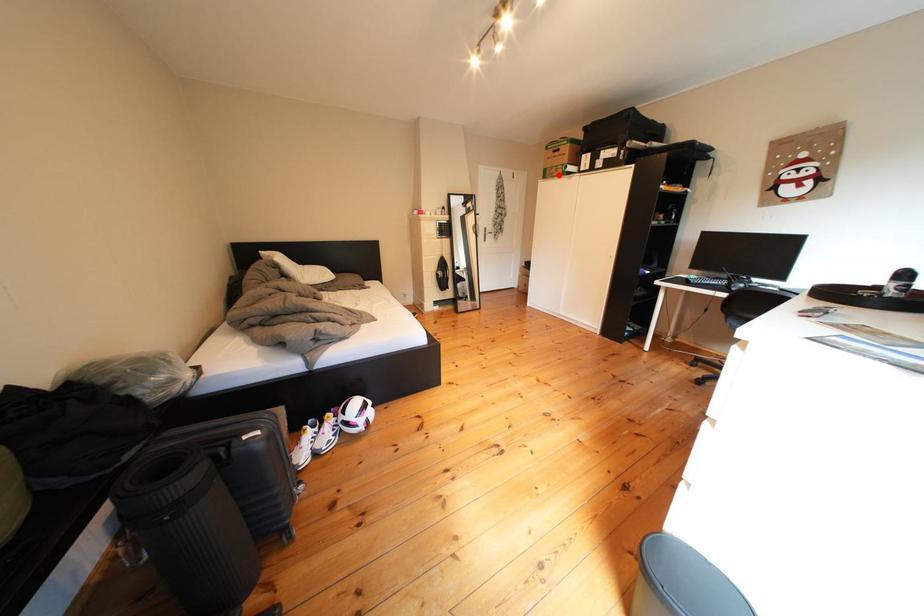
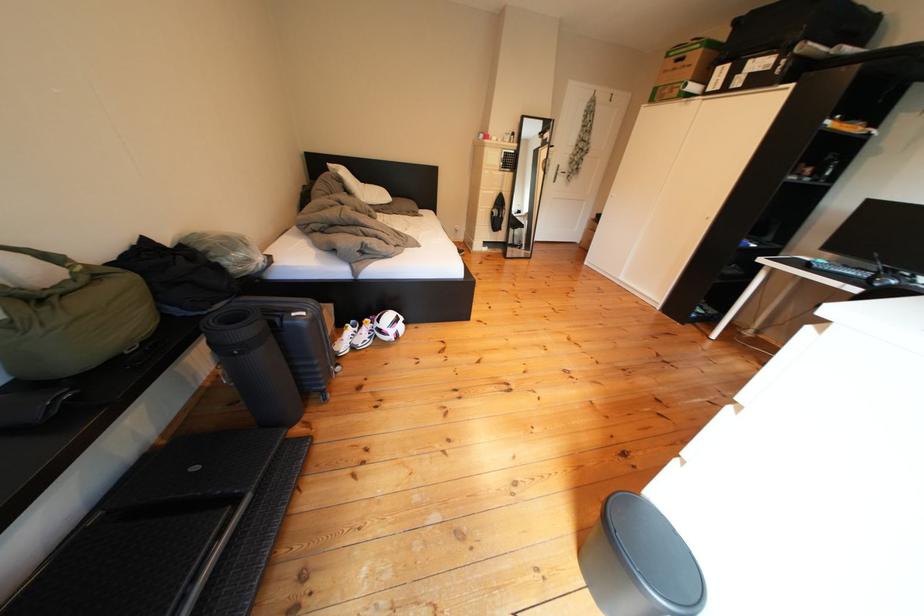
The point at the highlighted location is marked in the first image. Where is the corresponding point in the second image?

(670, 95)